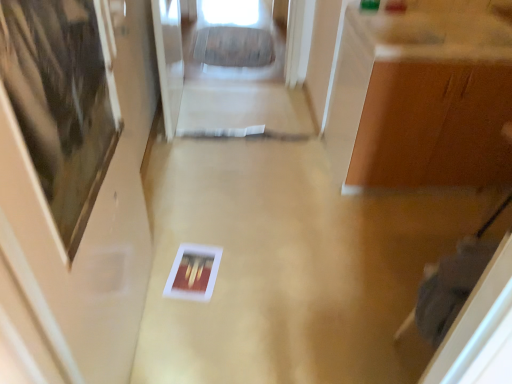
Locate an element on the screen. unoccupied area behind matte wood door at left is located at coordinates (212, 263).